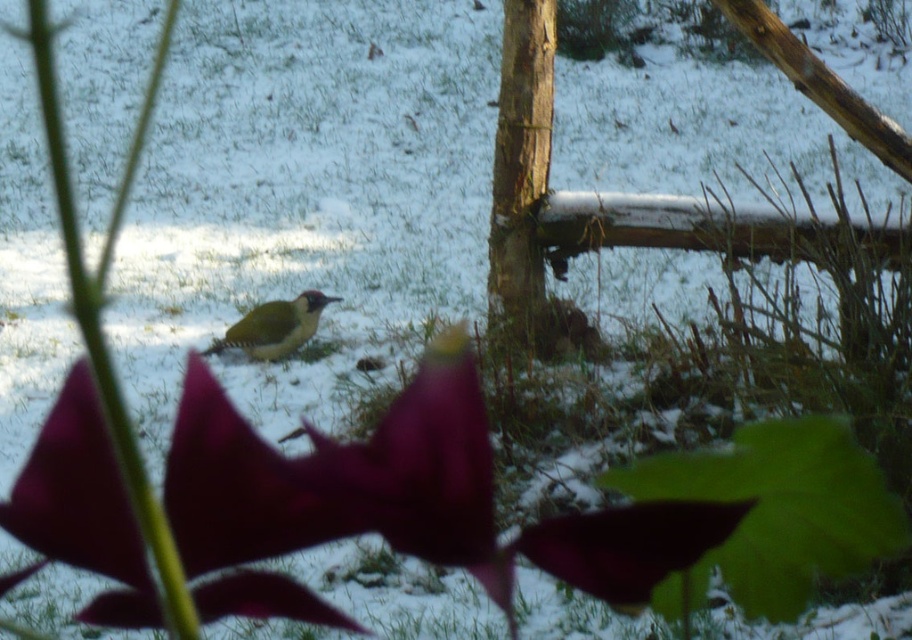
Question: Estimate the real-world distances between objects in this image. Which object is farther from the smooth bark tree trunk at center?

Choices:
 (A) shiny purple petal at center
 (B) green matte woodpecker at center

Answer: (A)

Question: Does smooth bark tree trunk at center have a greater width compared to green matte woodpecker at center?

Choices:
 (A) no
 (B) yes

Answer: (A)

Question: Does smooth bark tree trunk at center appear over green matte woodpecker at center?

Choices:
 (A) no
 (B) yes

Answer: (B)

Question: Based on their relative distances, which object is nearer to the smooth bark tree trunk at center?

Choices:
 (A) shiny purple petal at center
 (B) green matte woodpecker at center

Answer: (B)

Question: Among these points, which one is farthest from the camera?

Choices:
 (A) (537, 326)
 (B) (111, 486)

Answer: (A)

Question: Observing the image, what is the correct spatial positioning of smooth bark tree trunk at center in reference to green matte woodpecker at center?

Choices:
 (A) above
 (B) below

Answer: (A)